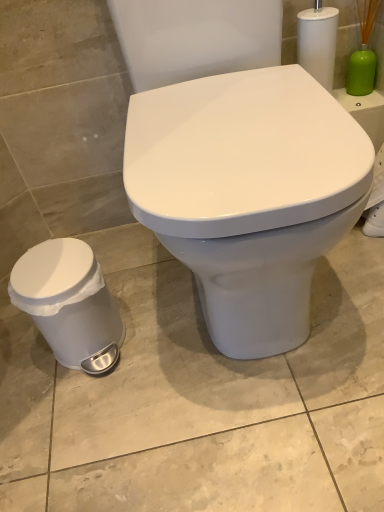
I want to click on vacant space behind white plastic trash can at lower left, so click(x=129, y=278).